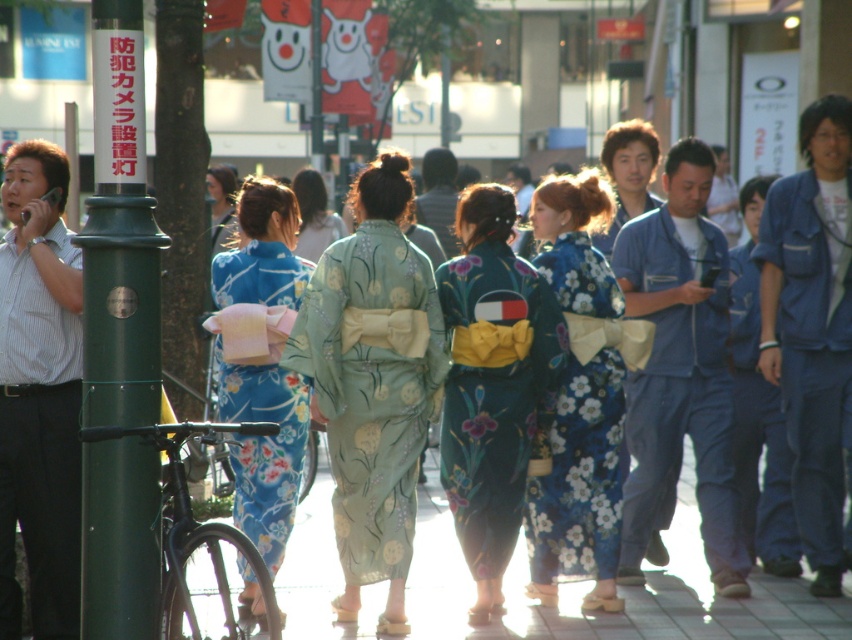
Question: Is light green floral kimono at center above denim jacket at right?

Choices:
 (A) yes
 (B) no

Answer: (B)

Question: Does striped cotton shirt at left have a greater width compared to floral silk kimono at center?

Choices:
 (A) no
 (B) yes

Answer: (A)

Question: Among these objects, which one is farthest from the camera?

Choices:
 (A) denim jacket at right
 (B) smooth blue kimono at center
 (C) light gray fabric kimono at center
 (D) light green silk kimono at center

Answer: (C)

Question: Which of these objects is positioned closest to the floral silk kimono at center?

Choices:
 (A) smooth blue kimono at center
 (B) smooth concrete pavement at center

Answer: (B)

Question: Among these points, which one is farthest from the camera?

Choices:
 (A) (298, 291)
 (B) (440, 150)
 (C) (389, 253)
 (D) (640, 154)

Answer: (B)

Question: Is light green floral kimono at center positioned before light gray fabric kimono at center?

Choices:
 (A) yes
 (B) no

Answer: (A)